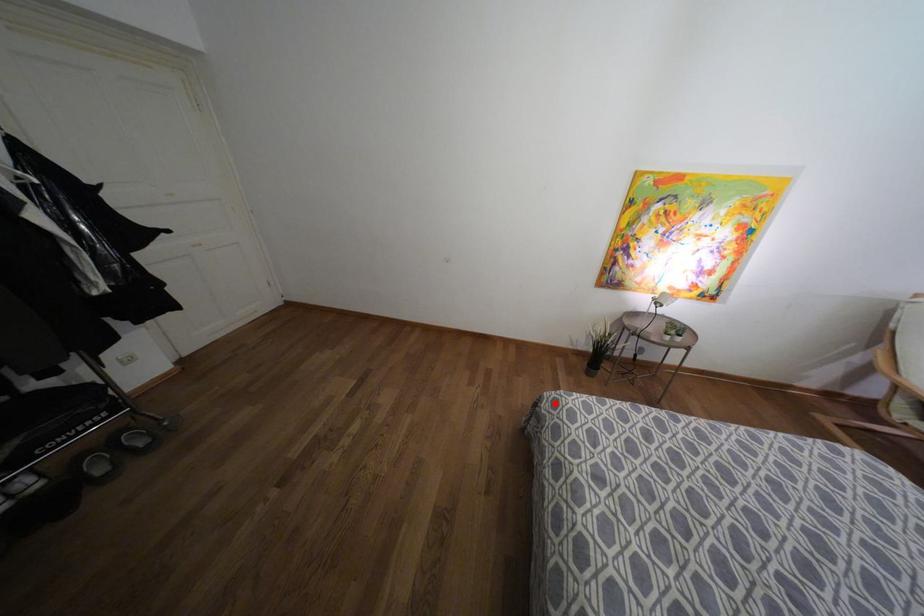
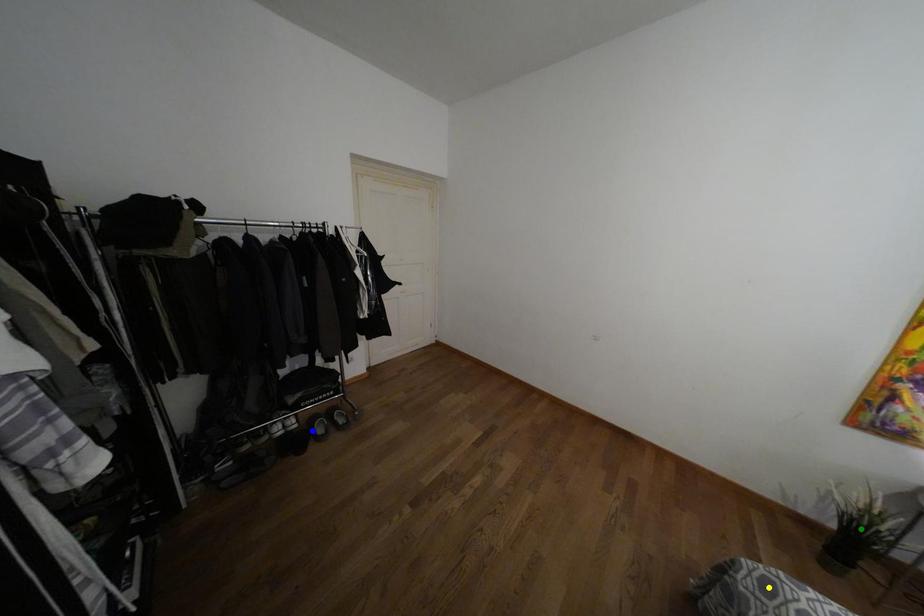
Question: I am providing you with two images of the same scene from different viewpoints. A red point is marked on the first image. You are given multiple points on the second image. Which point in image 2 represents the same 3d spot as the red point in image 1?

Choices:
 (A) blue point
 (B) yellow point
 (C) green point

Answer: (B)